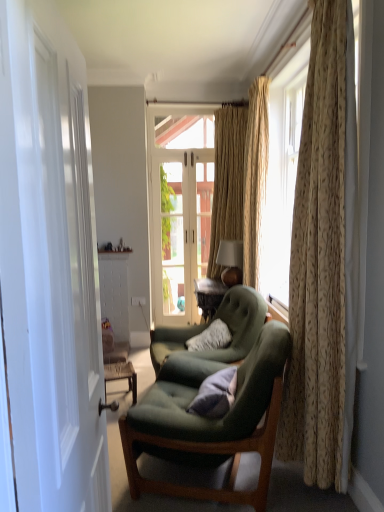
Question: Does white glossy door at left lie behind beige textured curtain at center, the 3th curtain viewed from the front?

Choices:
 (A) yes
 (B) no

Answer: (B)

Question: From a real-world perspective, is white glossy door at left located higher than beige textured curtain at center, which ranks as the first curtain in back-to-front order?

Choices:
 (A) no
 (B) yes

Answer: (A)

Question: Would you say white glossy door at left is outside beige textured curtain at center, the 3th curtain viewed from the front?

Choices:
 (A) yes
 (B) no

Answer: (A)

Question: Considering the relative sizes of white glossy door at left and beige textured curtain at center, which ranks as the first curtain in back-to-front order, in the image provided, is white glossy door at left smaller than beige textured curtain at center, which ranks as the first curtain in back-to-front order,?

Choices:
 (A) no
 (B) yes

Answer: (B)

Question: Is the depth of white glossy door at left less than that of beige textured curtain at center, which ranks as the first curtain in back-to-front order?

Choices:
 (A) no
 (B) yes

Answer: (B)

Question: Is white glossy door at left not near beige textured curtain at center, the 3th curtain viewed from the front?

Choices:
 (A) no
 (B) yes

Answer: (B)

Question: Is white plastic power outlet at center to the right of green fabric chair at center, the second chair positioned from the back, from the viewer's perspective?

Choices:
 (A) no
 (B) yes

Answer: (A)

Question: Is the depth of white plastic power outlet at center greater than that of green fabric chair at center, the second chair positioned from the back?

Choices:
 (A) no
 (B) yes

Answer: (B)

Question: Is white plastic power outlet at center turned away from green fabric chair at center, positioned as the first chair in front-to-back order?

Choices:
 (A) yes
 (B) no

Answer: (B)

Question: From the image's perspective, does white plastic power outlet at center appear higher than green fabric chair at center, the second chair positioned from the back?

Choices:
 (A) yes
 (B) no

Answer: (A)

Question: Is white plastic power outlet at center not within green fabric chair at center, positioned as the first chair in front-to-back order?

Choices:
 (A) yes
 (B) no

Answer: (A)

Question: From a real-world perspective, does white plastic power outlet at center stand above green fabric chair at center, positioned as the first chair in front-to-back order?

Choices:
 (A) yes
 (B) no

Answer: (A)

Question: Is green fabric couch at center thinner than green fabric chair at center, the second chair positioned from the back?

Choices:
 (A) no
 (B) yes

Answer: (B)